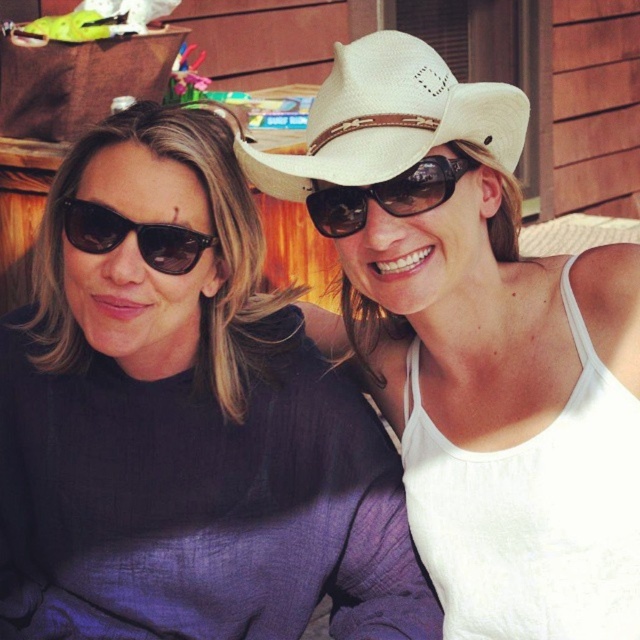
Can you confirm if white straw hat at upper center is shorter than matte black sunglasses at left?

No.

Describe the element at coordinates (476, 344) in the screenshot. The width and height of the screenshot is (640, 640). I see `white straw hat at upper center` at that location.

Locate an element on the screen. The height and width of the screenshot is (640, 640). white straw hat at upper center is located at coordinates (476, 344).

Can you confirm if white straw cowboy hat at upper center is thinner than matte black sunglasses at center?

In fact, white straw cowboy hat at upper center might be wider than matte black sunglasses at center.

Which is in front, point (433, 61) or point (436, 179)?

Positioned in front is point (436, 179).

You are a GUI agent. You are given a task and a screenshot of the screen. Output one action in this format:
    pyautogui.click(x=<x>, y=<y>)
    Task: Click on the white straw cowboy hat at upper center
    
    Given the screenshot: What is the action you would take?
    pyautogui.click(x=388, y=120)

Who is positioned more to the right, white straw hat at upper center or white straw cowboy hat at upper center?

white straw hat at upper center

Where is `white straw hat at upper center`? white straw hat at upper center is located at coordinates (476, 344).